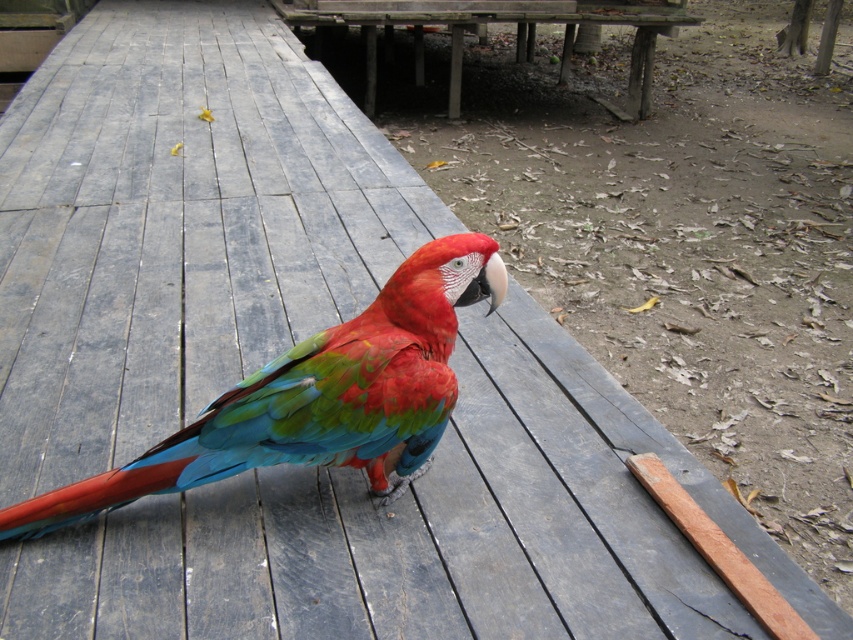
Between shiny multicolored parrot at center and wooden picnic table at center, which one has more height?

wooden picnic table at center

Describe the element at coordinates (316, 397) in the screenshot. Image resolution: width=853 pixels, height=640 pixels. I see `shiny multicolored parrot at center` at that location.

Is point (7, 528) behind point (393, 4)?

No.

This screenshot has height=640, width=853. I want to click on shiny multicolored parrot at center, so click(x=316, y=397).